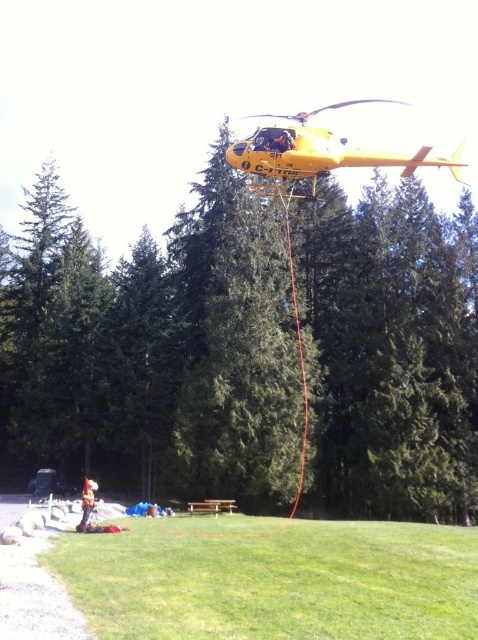
Who is taller, yellow matte helicopter at upper center or orange reflective vest at lower center?

yellow matte helicopter at upper center

The image size is (478, 640). What do you see at coordinates (323, 152) in the screenshot?
I see `yellow matte helicopter at upper center` at bounding box center [323, 152].

Is point (303, 173) positioned behind point (82, 524)?

No.

Identify the location of yellow matte helicopter at upper center. The image size is (478, 640). (323, 152).

Is green textured tree at center bigger than yellow matte helicopter at upper center?

Actually, green textured tree at center might be smaller than yellow matte helicopter at upper center.

Which of these two, green textured tree at center or yellow matte helicopter at upper center, stands shorter?

Standing shorter between the two is green textured tree at center.

Which is in front, point (180, 465) or point (305, 113)?

Point (180, 465) is more forward.

Identify the location of green textured tree at center. (153, 348).

Is green textured tree at center positioned at the back of orange reflective vest at lower center?

No, green textured tree at center is closer to the viewer.

Can you confirm if green textured tree at center is positioned above orange reflective vest at lower center?

Correct, green textured tree at center is located above orange reflective vest at lower center.

Is point (415, 224) positioned in front of point (84, 483)?

Yes.

Where is `green textured tree at center`? This screenshot has width=478, height=640. green textured tree at center is located at coordinates (153, 348).